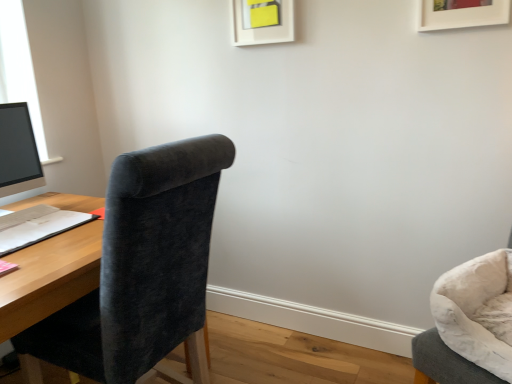
Question: From a real-world perspective, is white paper at left above or below velvet grey chair at right, placed as the 1th chair when sorted from right to left?

Choices:
 (A) above
 (B) below

Answer: (A)

Question: From their relative heights in the image, would you say white paper at left is taller or shorter than velvet grey chair at right, placed as the 1th chair when sorted from right to left?

Choices:
 (A) short
 (B) tall

Answer: (A)

Question: Which object is positioned closest to the white matte picture frame at upper center, positioned as the second picture frame in right-to-left order?

Choices:
 (A) matte black monitor at left
 (B) velvet grey chair at right, arranged as the 2th chair when viewed from the left
 (C) velvet dark gray chair at left, the first chair viewed from the left
 (D) white paper at left
 (E) white matte picture frame at upper right, the 1th picture frame in the front-to-back sequence

Answer: (E)

Question: Which object is the farthest from the matte black monitor at left?

Choices:
 (A) white matte picture frame at upper center, positioned as the second picture frame in right-to-left order
 (B) velvet dark gray chair at left, the second chair from the right
 (C) velvet grey chair at right, placed as the 1th chair when sorted from right to left
 (D) white paper at left
 (E) white matte picture frame at upper right, the 1th picture frame viewed from the right

Answer: (C)